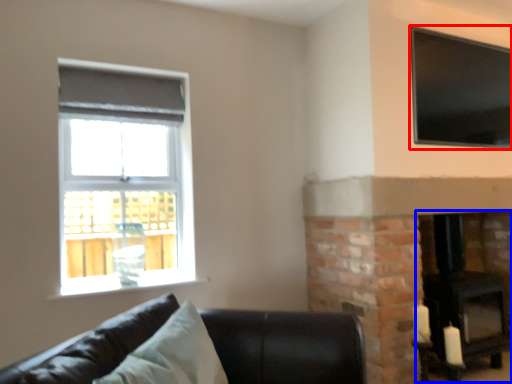
Question: Which object appears farthest to the camera in this image, window (highlighted by a red box) or fireplace (highlighted by a blue box)?

Choices:
 (A) window
 (B) fireplace

Answer: (B)